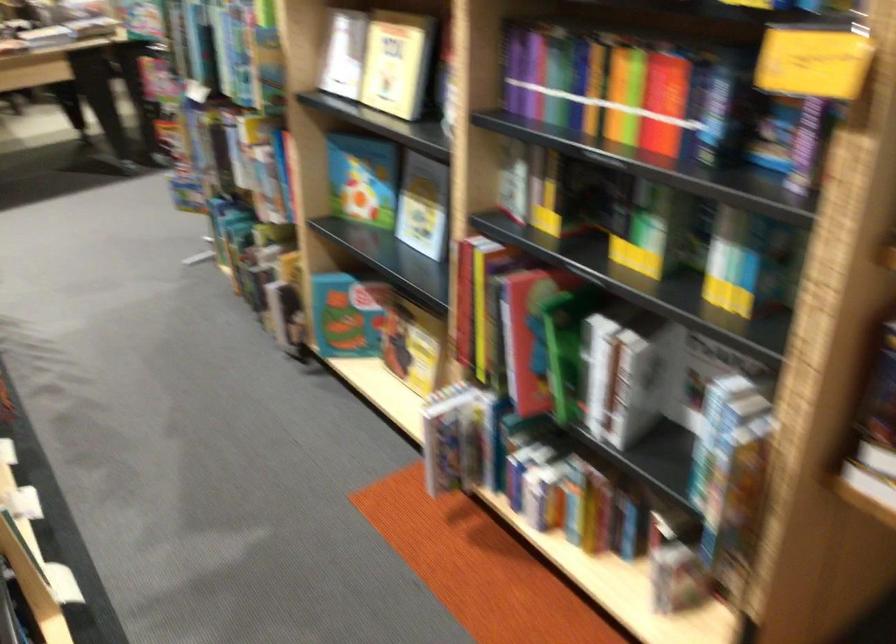
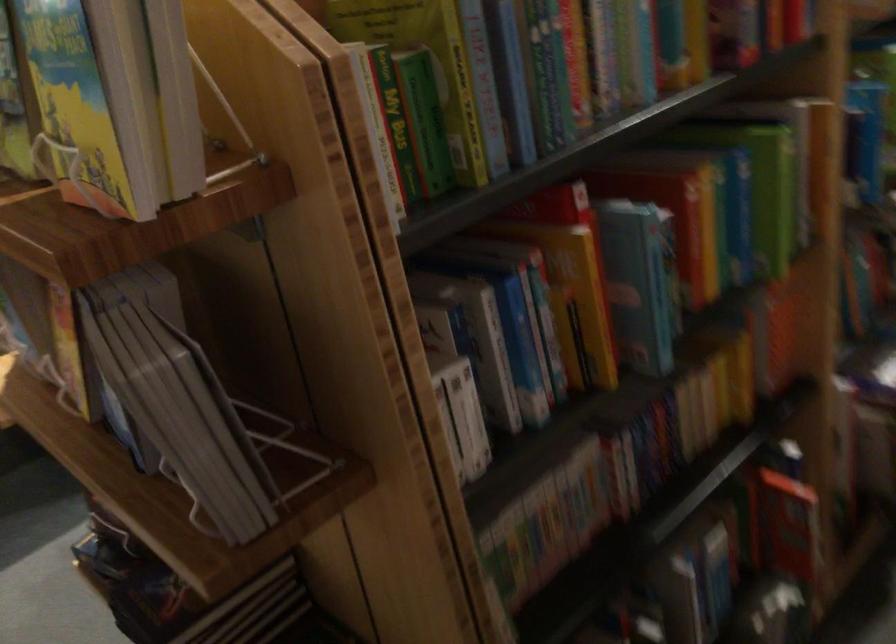
Question: I am providing you with two images of the same scene from different viewpoints. Please identify which objects are invisible in image2.

Choices:
 (A) whiteboard stand knob
 (B) stacked grey books
 (C) red covered book
 (D) white cup handle

Answer: (C)